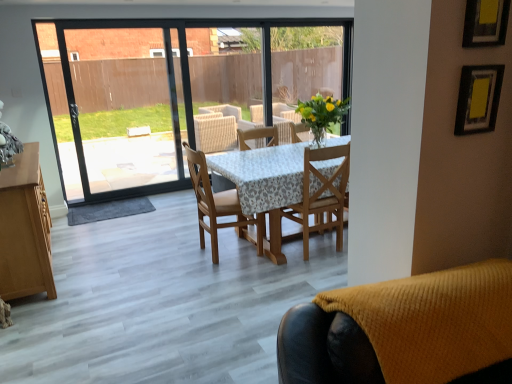
Question: Is point (303, 208) positioned closer to the camera than point (192, 160)?

Choices:
 (A) farther
 (B) closer

Answer: (B)

Question: Is wooden chair at center, which is the 2th chair in front-to-back order, inside the boundaries of wooden chair at center, which ranks as the first chair in back-to-front order, or outside?

Choices:
 (A) inside
 (B) outside

Answer: (B)

Question: Which object is the farthest from the wooden chair at center, the third chair positioned from the front?

Choices:
 (A) knitted yellow chair at lower right, which is the first chair from front to back
 (B) wooden chair at center, which is the 2th chair in front-to-back order

Answer: (A)

Question: Which object is positioned farthest from the wooden chair at center, which is the 2th chair in front-to-back order?

Choices:
 (A) wooden chair at center, the third chair positioned from the front
 (B) knitted yellow chair at lower right, which is the first chair from front to back

Answer: (B)